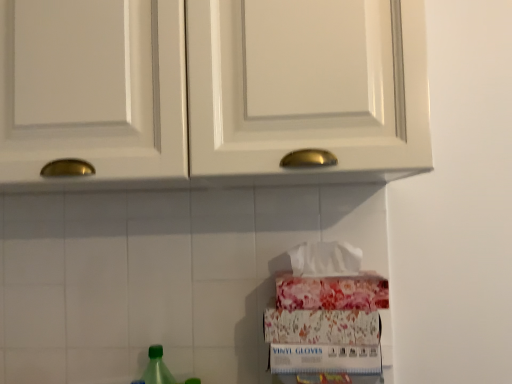
This screenshot has width=512, height=384. Find the location of `green matte bottle at lower left`. green matte bottle at lower left is located at coordinates (157, 368).

What do you see at coordinates (157, 368) in the screenshot? I see `green matte bottle at lower left` at bounding box center [157, 368].

Measure the distance between green matte bottle at lower left and camera.

The distance of green matte bottle at lower left from camera is 37.72 inches.

What is the approximate height of white glossy cabinet doors at upper center?

48.86 centimeters.

Image resolution: width=512 pixels, height=384 pixels. What do you see at coordinates (240, 99) in the screenshot?
I see `white glossy cabinet doors at upper center` at bounding box center [240, 99].

You are a GUI agent. You are given a task and a screenshot of the screen. Output one action in this format:
    pyautogui.click(x=<x>, y=<y>)
    Task: Click on the white glossy cabinet doors at upper center
    
    Given the screenshot: What is the action you would take?
    pyautogui.click(x=240, y=99)

Where is `green matte bottle at lower left`? The height and width of the screenshot is (384, 512). green matte bottle at lower left is located at coordinates (157, 368).

Considering the positions of objects white glossy cabinet doors at upper center and green matte bottle at lower left in the image provided, who is more to the right, white glossy cabinet doors at upper center or green matte bottle at lower left?

Positioned to the right is white glossy cabinet doors at upper center.

Which object is more forward, white glossy cabinet doors at upper center or green matte bottle at lower left?

white glossy cabinet doors at upper center is closer to the camera.

Is point (401, 58) positioned behind point (154, 374)?

No.

From the image's perspective, which is above, white glossy cabinet doors at upper center or green matte bottle at lower left?

white glossy cabinet doors at upper center.

From the picture: From a real-world perspective, is white glossy cabinet doors at upper center on top of green matte bottle at lower left?

Yes, from a real-world perspective, white glossy cabinet doors at upper center is over green matte bottle at lower left

Can you confirm if white glossy cabinet doors at upper center is thinner than green matte bottle at lower left?

In fact, white glossy cabinet doors at upper center might be wider than green matte bottle at lower left.

Which of these two, white glossy cabinet doors at upper center or green matte bottle at lower left, stands shorter?

green matte bottle at lower left.

Considering the sizes of objects white glossy cabinet doors at upper center and green matte bottle at lower left in the image provided, who is bigger, white glossy cabinet doors at upper center or green matte bottle at lower left?

With larger size is white glossy cabinet doors at upper center.

Is green matte bottle at lower left located within white glossy cabinet doors at upper center?

No.

Is white glossy cabinet doors at upper center far from green matte bottle at lower left?

white glossy cabinet doors at upper center is actually quite close to green matte bottle at lower left.

Is white glossy cabinet doors at upper center facing towards green matte bottle at lower left?

No, white glossy cabinet doors at upper center does not turn towards green matte bottle at lower left.

How many degrees apart are the facing directions of white glossy cabinet doors at upper center and green matte bottle at lower left?

There is a 0.754-degree angle between the facing directions of white glossy cabinet doors at upper center and green matte bottle at lower left.

Locate an element on the screen. bottle behind the white glossy cabinet doors at upper center is located at coordinates (157, 368).

Considering the relative positions of green matte bottle at lower left and white glossy cabinet doors at upper center in the image provided, is green matte bottle at lower left to the left of white glossy cabinet doors at upper center from the viewer's perspective?

Yes, green matte bottle at lower left is to the left of white glossy cabinet doors at upper center.

Is the position of green matte bottle at lower left less distant than that of white glossy cabinet doors at upper center?

That is False.

Considering the points (155, 346) and (126, 187), which point is in front, point (155, 346) or point (126, 187)?

The point (155, 346) is closer to the camera.

From the image's perspective, is green matte bottle at lower left located above or below white glossy cabinet doors at upper center?

From the image's perspective, green matte bottle at lower left appears below white glossy cabinet doors at upper center.

From a real-world perspective, which object rests below the other?

green matte bottle at lower left, from a real-world perspective.

Considering the sizes of objects green matte bottle at lower left and white glossy cabinet doors at upper center in the image provided, who is thinner, green matte bottle at lower left or white glossy cabinet doors at upper center?

Thinner between the two is green matte bottle at lower left.

Can you confirm if green matte bottle at lower left is shorter than white glossy cabinet doors at upper center?

Yes.

Considering the relative sizes of green matte bottle at lower left and white glossy cabinet doors at upper center in the image provided, is green matte bottle at lower left bigger than white glossy cabinet doors at upper center?

Incorrect, green matte bottle at lower left is not larger than white glossy cabinet doors at upper center.

Choose the correct answer: Is green matte bottle at lower left inside white glossy cabinet doors at upper center or outside it?

green matte bottle at lower left is not inside white glossy cabinet doors at upper center, it's outside.

Consider the image. Is green matte bottle at lower left not close to white glossy cabinet doors at upper center?

No, green matte bottle at lower left is in close proximity to white glossy cabinet doors at upper center.

Does green matte bottle at lower left turn towards white glossy cabinet doors at upper center?

No, green matte bottle at lower left is not aimed at white glossy cabinet doors at upper center.

At what (x,y) coordinates should I click in order to perform the action: click on bottle to the left of white glossy cabinet doors at upper center. Please return your answer as a coordinate pair (x, y). The width and height of the screenshot is (512, 384). Looking at the image, I should click on (157, 368).

The width and height of the screenshot is (512, 384). I want to click on cabinetry located above the green matte bottle at lower left (from the image's perspective), so click(x=240, y=99).

You are a GUI agent. You are given a task and a screenshot of the screen. Output one action in this format:
    pyautogui.click(x=<x>, y=<y>)
    Task: Click on the bottle below the white glossy cabinet doors at upper center (from a real-world perspective)
    This screenshot has width=512, height=384.
    Given the screenshot: What is the action you would take?
    pyautogui.click(x=157, y=368)